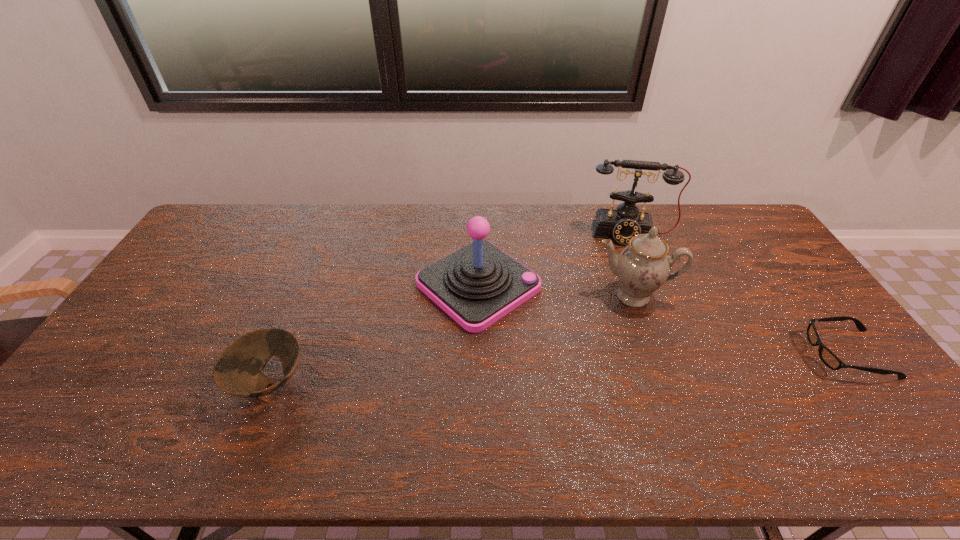
This screenshot has width=960, height=540. Find the location of `vacant space on the desktop that is between the leftmost object and the spectacles and is positioned forward from the base of the joystick`. vacant space on the desktop that is between the leftmost object and the spectacles and is positioned forward from the base of the joystick is located at coordinates (583, 367).

I want to click on vacant space on the desktop that is between the bowl and the spectacles and is positioned on the dial of the telephone, so click(x=646, y=364).

Locate an element on the screen. This screenshot has height=540, width=960. free space on the desktop that is between the leftmost object and the shortest object and is positioned on the spout of the chinaware is located at coordinates (635, 364).